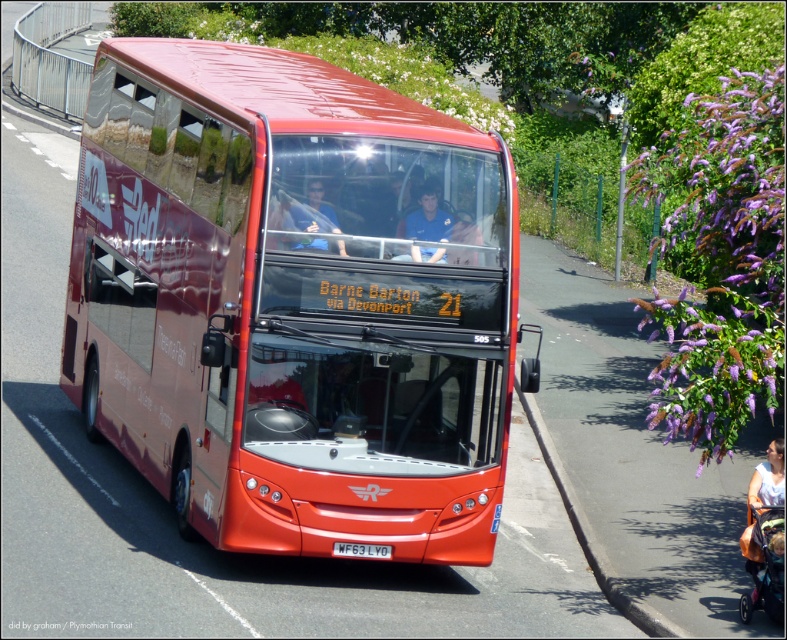
Is point (120, 93) positioned behind point (771, 456)?

That is True.

Is metallic red bus at center shorter than white fabric person at lower right?

Incorrect, metallic red bus at center's height does not fall short of white fabric person at lower right's.

Who is more forward, (301, 456) or (778, 461)?

Point (301, 456)

This screenshot has width=787, height=640. I want to click on metallic red bus at center, so click(290, 301).

Does metallic red bus at center have a lesser width compared to white plastic license plate at center?

Yes.

Consider the image. Is metallic red bus at center positioned in front of white plastic license plate at center?

That is True.

Does point (323, 300) come in front of point (372, 556)?

Yes.

Identify the location of metallic red bus at center. (290, 301).

Does blue fabric shirt at center appear on the right side of matte black shirt at center?

Yes, blue fabric shirt at center is to the right of matte black shirt at center.

Consider the image. Measure the distance between blue fabric shirt at center and matte black shirt at center.

blue fabric shirt at center is 29.69 inches from matte black shirt at center.

Who is more forward, (420, 189) or (313, 224)?

Point (313, 224)

The image size is (787, 640). I want to click on blue fabric shirt at center, so 427,216.